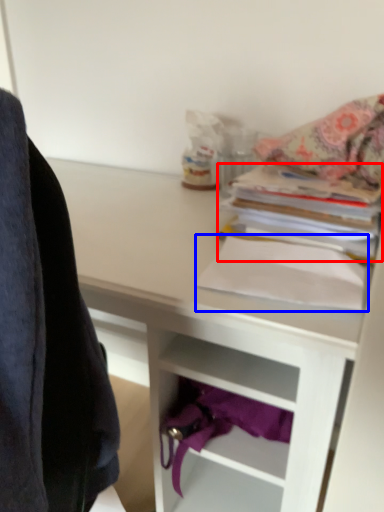
Question: Which point is closer to the camera, paperback book (highlighted by a red box) or paperback book (highlighted by a blue box)?

Choices:
 (A) paperback book
 (B) paperback book

Answer: (B)